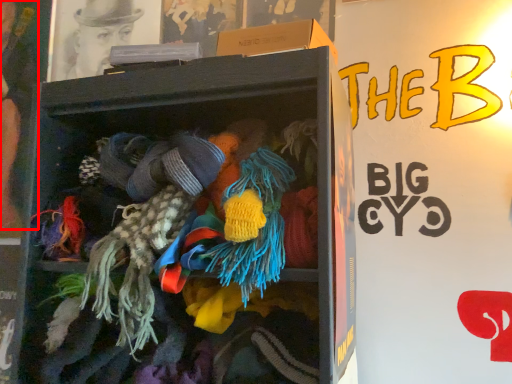
Question: Observing the image, what is the correct spatial positioning of person (annotated by the red box) in reference to shelf?

Choices:
 (A) right
 (B) left

Answer: (B)